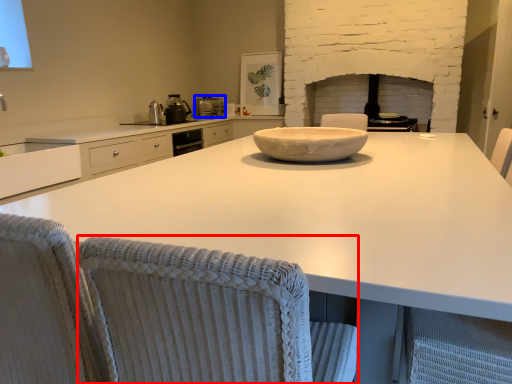
Question: Among these objects, which one is farthest to the camera, swivel chair (highlighted by a red box) or kitchen appliance (highlighted by a blue box)?

Choices:
 (A) swivel chair
 (B) kitchen appliance

Answer: (B)